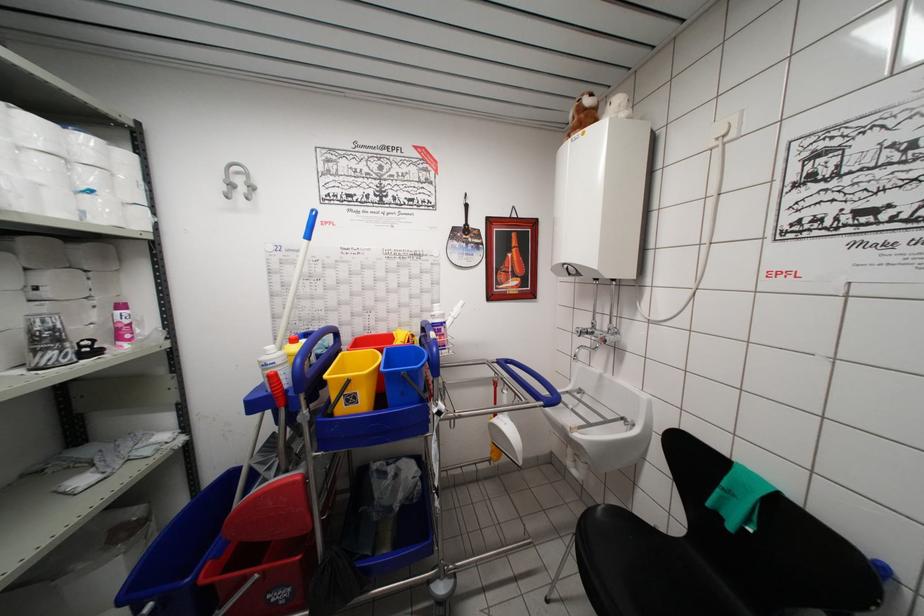
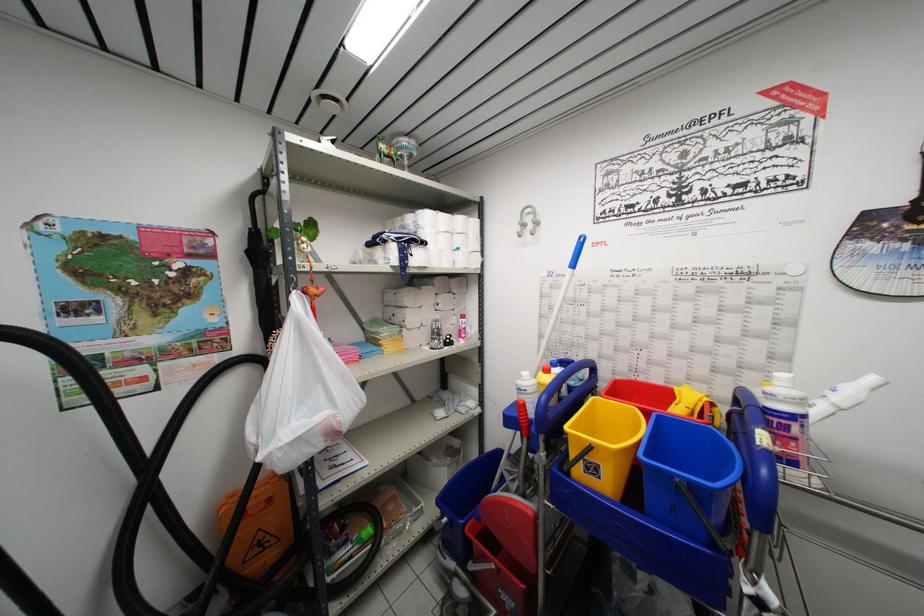
Locate, in the second image, the point that corresponds to [315,216] in the first image.

(584, 241)